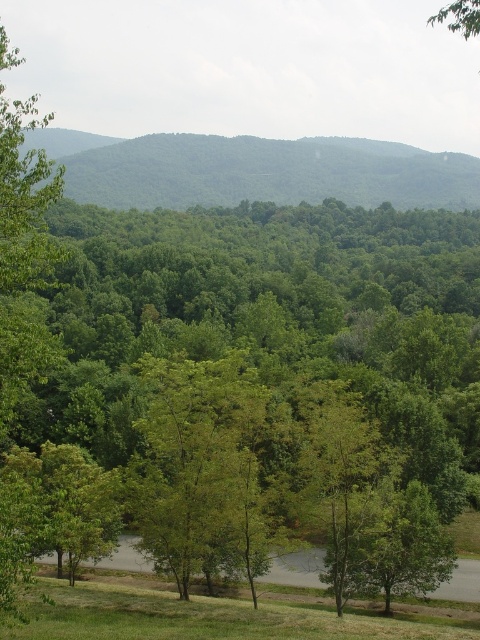
Question: Which of the following is the farthest from the observer?

Choices:
 (A) (464, 323)
 (B) (235, 618)
 (C) (109, 186)

Answer: (C)

Question: Observing the image, what is the correct spatial positioning of green leafy forest at upper center in reference to green grassy at lower center?

Choices:
 (A) below
 (B) above

Answer: (B)

Question: Is green leafy tree at center positioned before green grassy at lower center?

Choices:
 (A) no
 (B) yes

Answer: (B)

Question: Is green leafy tree at center to the left of green grassy at lower center from the viewer's perspective?

Choices:
 (A) no
 (B) yes

Answer: (A)

Question: Which object is positioned farthest from the green leafy forest at upper center?

Choices:
 (A) green grassy at lower center
 (B) green leafy tree at center

Answer: (A)

Question: Which object is closer to the camera taking this photo?

Choices:
 (A) green leafy tree at center
 (B) green leafy forest at upper center
 (C) green grassy at lower center

Answer: (A)